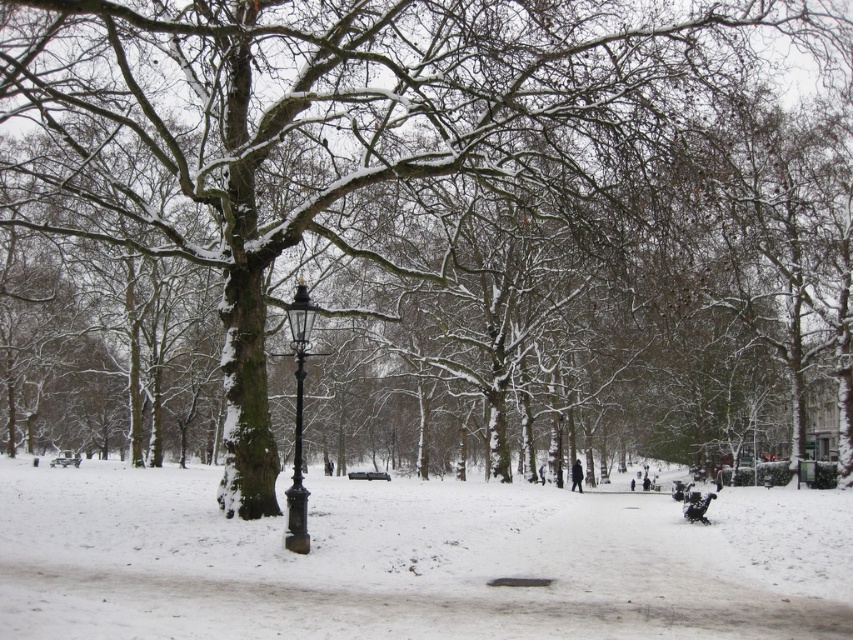
Locate an element on the screen. white powdery snow at center is located at coordinates (413, 560).

Is white powdery snow at center smaller than black wrought iron lamp post at center?

No.

Who is more distant from viewer, (x=653, y=502) or (x=288, y=506)?

Point (x=653, y=502)

Find the location of `white powdery snow at center`. white powdery snow at center is located at coordinates (413, 560).